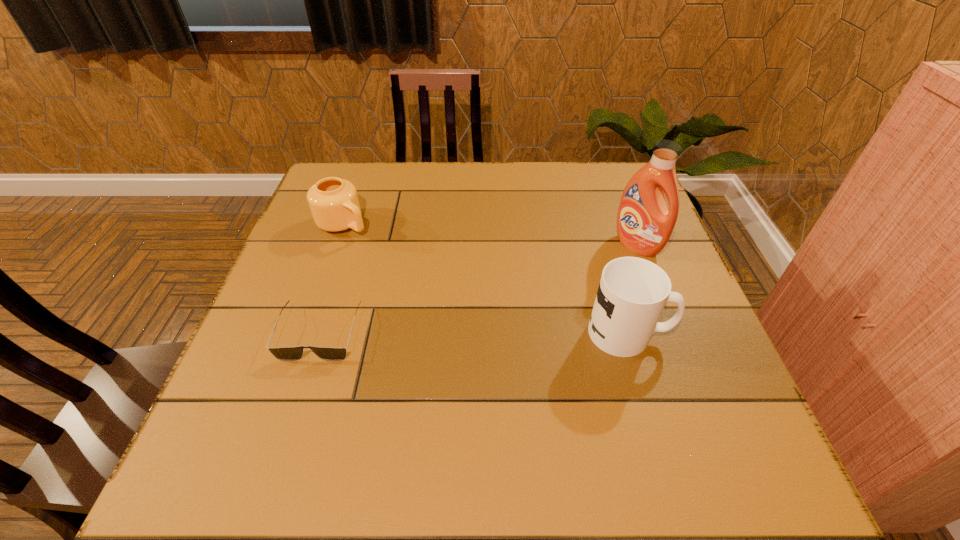
The width and height of the screenshot is (960, 540). In order to click on the shortest object in this screenshot , I will do [285, 353].

In order to click on the taller mug in this screenshot , I will do `click(632, 293)`.

Locate an element on the screen. Image resolution: width=960 pixels, height=540 pixels. the right mug is located at coordinates (632, 293).

Where is `the tallest object`? the tallest object is located at coordinates (644, 225).

Image resolution: width=960 pixels, height=540 pixels. In order to click on the left mug in this screenshot , I will do pyautogui.click(x=334, y=204).

Where is `the third tallest object`? This screenshot has width=960, height=540. the third tallest object is located at coordinates coord(334,204).

This screenshot has width=960, height=540. What are the coordinates of `vacant space located 0.130m on the front-facing side of the sunglasses` in the screenshot? It's located at (292, 422).

You are a GUI agent. You are given a task and a screenshot of the screen. Output one action in this format:
    pyautogui.click(x=<x>, y=<y>)
    Task: Click on the free space located 0.060m on the handle side of the right mug
    This screenshot has height=540, width=960.
    Given the screenshot: What is the action you would take?
    pyautogui.click(x=697, y=333)

Locate an element on the screen. free space located on the front-facing side of the detergent is located at coordinates (545, 309).

Where is `free region located 0.100m on the front-facing side of the detergent`? The image size is (960, 540). free region located 0.100m on the front-facing side of the detergent is located at coordinates (598, 273).